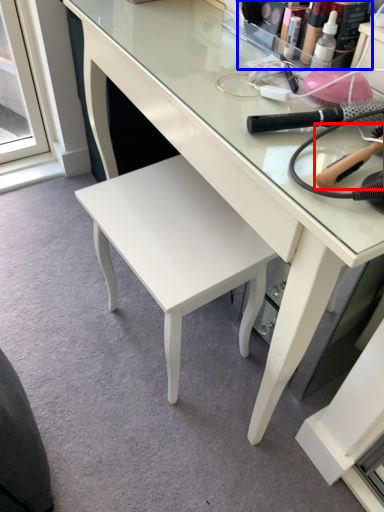
Question: Among these objects, which one is nearest to the camera, brush (highlighted by a red box) or toiletry (highlighted by a blue box)?

Choices:
 (A) brush
 (B) toiletry

Answer: (A)